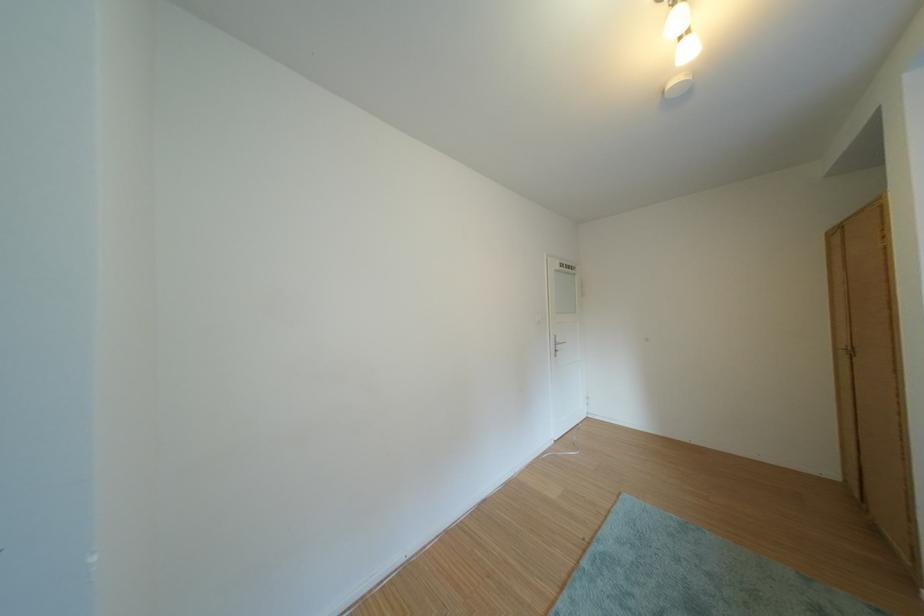
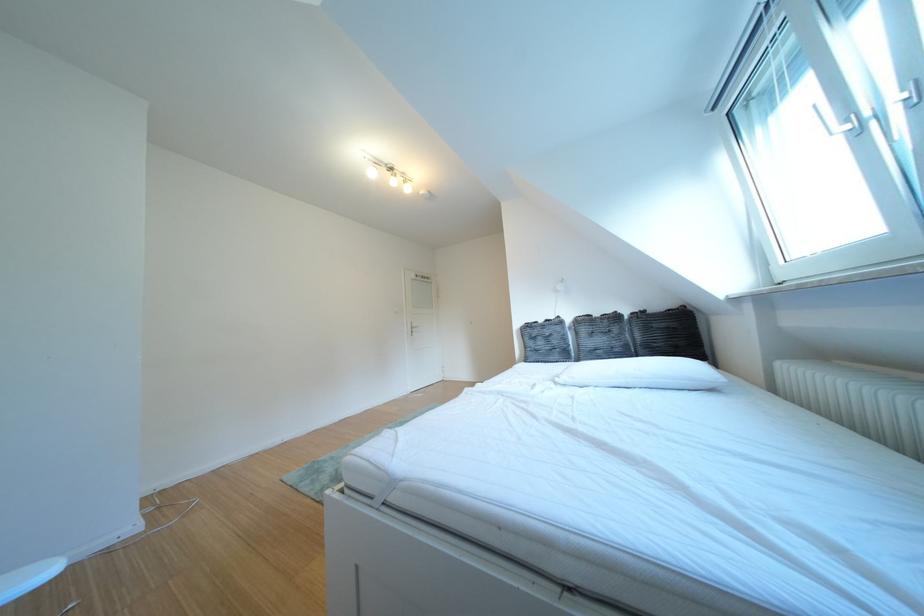
In the scene shown: What movement of the cameraman would produce the second image?

The cameraman walked toward right, backward.